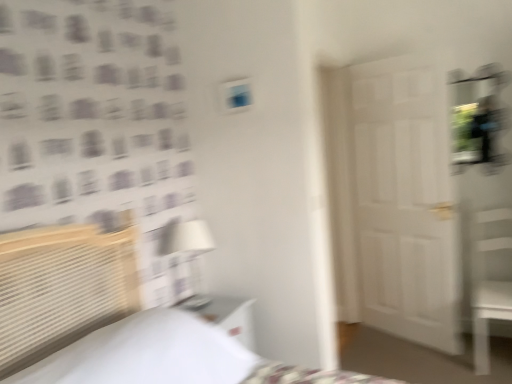
At what (x,y) coordinates should I click in order to perform the action: click on white fabric lampshade at center. Please return your answer as a coordinate pair (x, y). Image resolution: width=512 pixels, height=384 pixels. Looking at the image, I should click on (186, 242).

The height and width of the screenshot is (384, 512). Describe the element at coordinates (394, 199) in the screenshot. I see `white matte door at center` at that location.

The height and width of the screenshot is (384, 512). What do you see at coordinates (490, 279) in the screenshot?
I see `white wood chair at right` at bounding box center [490, 279].

I want to click on white woven bed at left, so click(112, 320).

Does white fabric lampshade at center appear on the left side of white glossy nightstand at lower center?

Yes.

Is white fabric lampshade at center in front of or behind white glossy nightstand at lower center in the image?

Clearly, white fabric lampshade at center is behind white glossy nightstand at lower center.

Based on their sizes in the image, would you say white fabric lampshade at center is bigger or smaller than white glossy nightstand at lower center?

white fabric lampshade at center is smaller than white glossy nightstand at lower center.

Is white fabric lampshade at center taller than white glossy nightstand at lower center?

Yes, white fabric lampshade at center is taller than white glossy nightstand at lower center.

From the picture: Considering the sizes of objects white fabric lampshade at center and white wood chair at right in the image provided, who is smaller, white fabric lampshade at center or white wood chair at right?

Smaller between the two is white fabric lampshade at center.

I want to click on furniture directly beneath the white fabric lampshade at center (from a real-world perspective), so click(490, 279).

Are white fabric lampshade at center and white wood chair at right far apart?

white fabric lampshade at center is positioned a significant distance from white wood chair at right.

Which of these two, white fabric lampshade at center or white wood chair at right, stands taller?

white wood chair at right.

From a real-world perspective, is white fabric lampshade at center over white woven bed at left?

No, from a real-world perspective, white fabric lampshade at center is not above white woven bed at left.

Image resolution: width=512 pixels, height=384 pixels. In order to click on table lamp on the left of white woven bed at left in this screenshot , I will do `click(186, 242)`.

Which object is positioned more to the right, white fabric lampshade at center or white woven bed at left?

white woven bed at left is more to the right.

Can we say white fabric lampshade at center lies outside white woven bed at left?

white fabric lampshade at center is positioned outside white woven bed at left.

Which is in front, white matte door at center or white woven bed at left?

white woven bed at left is closer to the camera.

From the image's perspective, is white matte door at center beneath white woven bed at left?

Actually, white matte door at center appears above white woven bed at left in the image.

Locate an element on the screen. door behind the white woven bed at left is located at coordinates (394, 199).

Would you say white matte door at center is a long distance from white woven bed at left?

Indeed, white matte door at center is not near white woven bed at left.

Could you tell me if white woven bed at left is facing white fabric lampshade at center?

No, white woven bed at left does not turn towards white fabric lampshade at center.

From a real-world perspective, is white woven bed at left positioned over white fabric lampshade at center based on gravity?

Correct, in the physical world, white woven bed at left is higher than white fabric lampshade at center.

How different are the orientations of white woven bed at left and white fabric lampshade at center in degrees?

The angle between the facing direction of white woven bed at left and the facing direction of white fabric lampshade at center is 3.81 degrees.

Find the location of a particular element. The image size is (512, 384). table lamp on the left of white woven bed at left is located at coordinates (186, 242).

Locate an element on the screen. nightstand below the white matte door at center (from the image's perspective) is located at coordinates (225, 315).

Is white glossy nightstand at lower center in front of or behind white matte door at center in the image?

In the image, white glossy nightstand at lower center appears in front of white matte door at center.

Does white glossy nightstand at lower center turn towards white matte door at center?

No, white glossy nightstand at lower center is not aimed at white matte door at center.

Considering the relative sizes of white fabric lampshade at center and white matte door at center in the image provided, is white fabric lampshade at center smaller than white matte door at center?

Yes, white fabric lampshade at center is smaller than white matte door at center.

Measure the distance between white fabric lampshade at center and white matte door at center.

1.44 meters.

This screenshot has width=512, height=384. In order to click on door located on the right of white fabric lampshade at center in this screenshot , I will do `click(394, 199)`.

From a real-world perspective, is white fabric lampshade at center positioned above or below white matte door at center?

In terms of real-world spatial position, white fabric lampshade at center is below white matte door at center.

The width and height of the screenshot is (512, 384). What are the coordinates of `nightstand below the white fabric lampshade at center (from a real-world perspective)` in the screenshot? It's located at (225, 315).

Find the location of `furniture on the right of white fabric lampshade at center`. furniture on the right of white fabric lampshade at center is located at coordinates (490, 279).

Estimate the real-world distances between objects in this image. Which object is closer to white glossy nightstand at lower center, white fabric lampshade at center or white matte door at center?

The object closer to white glossy nightstand at lower center is white fabric lampshade at center.

Considering their positions, is white wood chair at right positioned closer to white woven bed at left than white glossy nightstand at lower center?

white glossy nightstand at lower center is positioned closer to the anchor white woven bed at left.

Estimate the real-world distances between objects in this image. Which object is closer to white woven bed at left, white wood chair at right or white fabric lampshade at center?

Among the two, white fabric lampshade at center is located nearer to white woven bed at left.

Looking at the image, which one is located further to white fabric lampshade at center, white glossy nightstand at lower center or white woven bed at left?

Based on the image, white woven bed at left appears to be further to white fabric lampshade at center.

Based on their spatial positions, is white fabric lampshade at center or white matte door at center further from white wood chair at right?

white fabric lampshade at center is positioned further to the anchor white wood chair at right.

From the picture: Considering their positions, is white woven bed at left positioned further to white fabric lampshade at center than white glossy nightstand at lower center?

Among the two, white woven bed at left is located further to white fabric lampshade at center.

Considering their positions, is white glossy nightstand at lower center positioned further to white wood chair at right than white fabric lampshade at center?

Among the two, white fabric lampshade at center is located further to white wood chair at right.

Based on their spatial positions, is white fabric lampshade at center or white glossy nightstand at lower center further from white woven bed at left?

white fabric lampshade at center is positioned further to the anchor white woven bed at left.

The height and width of the screenshot is (384, 512). I want to click on door situated between white fabric lampshade at center and white wood chair at right from left to right, so click(x=394, y=199).

In order to click on nightstand between white woven bed at left and white fabric lampshade at center along the z-axis in this screenshot , I will do `click(225, 315)`.

In order to click on nightstand between white fabric lampshade at center and white matte door at center from left to right in this screenshot , I will do `click(225, 315)`.

Locate an element on the screen. The width and height of the screenshot is (512, 384). door between white glossy nightstand at lower center and white wood chair at right is located at coordinates (394, 199).